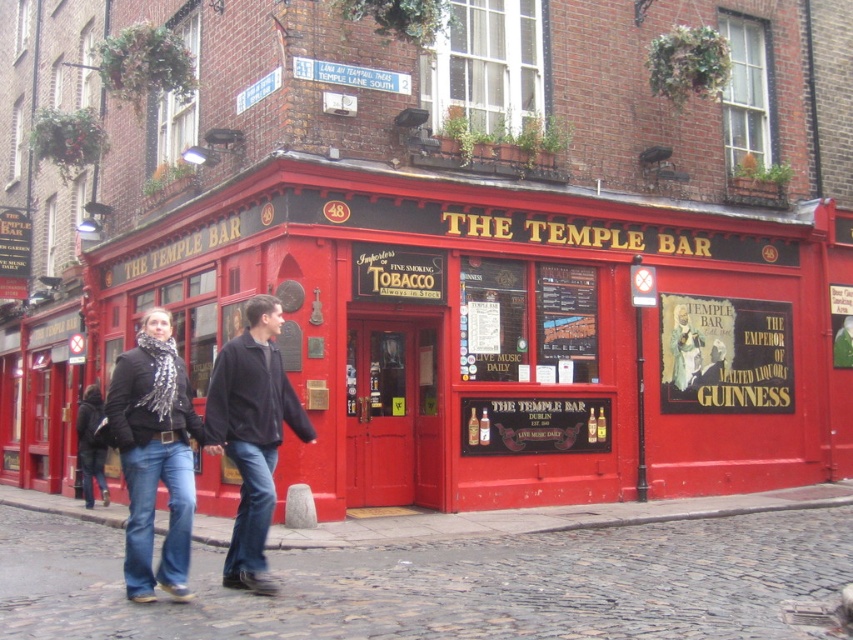
You are a delivery person trying to place a small package between the black suede jacket at center and the black matte jacket at lower left. Can the package fit in the space between them if the package is 50 centimeters long?

The black suede jacket at center is 50.75 centimeters away from the black matte jacket at lower left. Since the package is 50 centimeters long, it can fit in the space between them as the distance is slightly larger than the package length.

You are a tourist standing at the Temple Bar entrance. You notice the cobblestone at lower center and the black matte jacket at lower left. Which object is closer to the ground?

The cobblestone at lower center is closer to the ground since it is not as tall as the black matte jacket at lower left.

You are standing at the entrance of The Temple Bar pub in Dublin. You want to take a photo of the cobblestone at lower center while holding your camera at waist height. Considering the distance between you and the cobblestone, will you need to zoom in or out to capture the cobblestone clearly in your shot?

The distance between you and the cobblestone at lower center is 5.36 meters. Since the cobblestone is relatively far away from the camera, you will need to zoom in to ensure it is captured clearly in your photo.